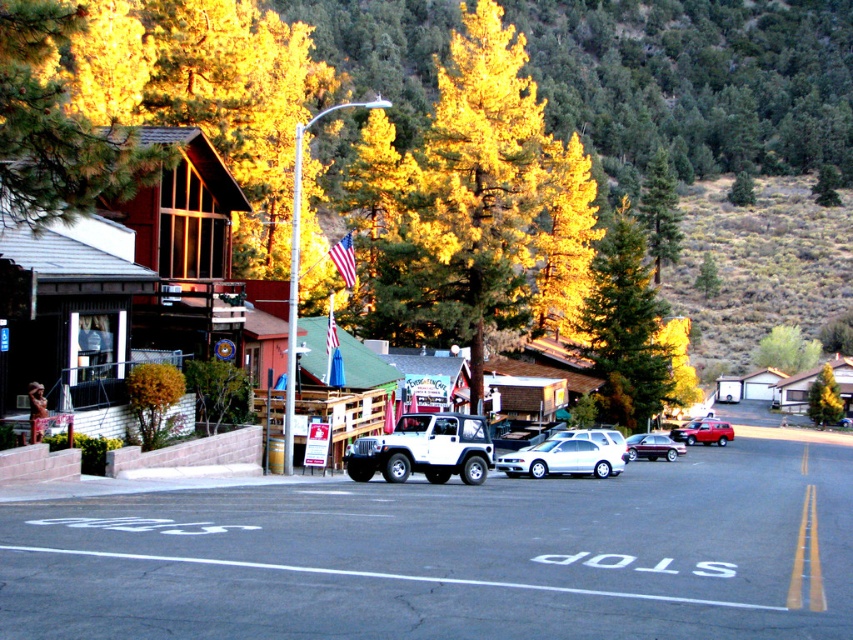
Question: Estimate the real-world distances between objects in this image. Which object is closer to the golden pine tree at upper left?

Choices:
 (A) matte red suv at center
 (B) green leafy tree at center-right
 (C) white matte suv at center

Answer: (C)

Question: Does golden pine tree at upper left have a smaller size compared to green leafy tree at center?

Choices:
 (A) no
 (B) yes

Answer: (B)

Question: Is white matte suv at center bigger than white glossy sedan at center?

Choices:
 (A) no
 (B) yes

Answer: (A)

Question: Where is white matte suv at center located in relation to yellow/golden pine tree at center in the image?

Choices:
 (A) right
 (B) left

Answer: (B)

Question: Which of these objects is positioned farthest from the green leafy tree at center?

Choices:
 (A) metallic maroon sedan at center
 (B) white matte suv at center
 (C) yellow/golden pine tree at center
 (D) matte red suv at center

Answer: (B)

Question: Which object is the farthest from the green leafy tree at center-right?

Choices:
 (A) metallic maroon sedan at center
 (B) green textured tree at center
 (C) green leafy tree at center
 (D) golden pine tree at upper left

Answer: (D)